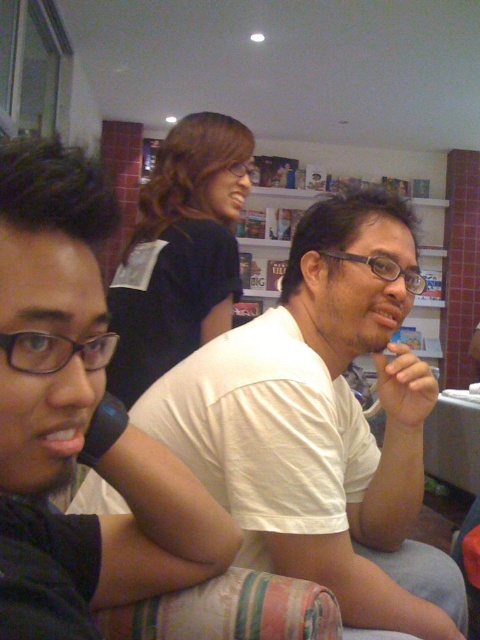
You are standing in the room and want to place a small plant between the two points, point (149, 570) and point (282, 196). Which point should the plant be closer to in order to be nearer to the viewer?

The plant should be closer to point (149, 570) because it is closer to the viewer than point (282, 196).